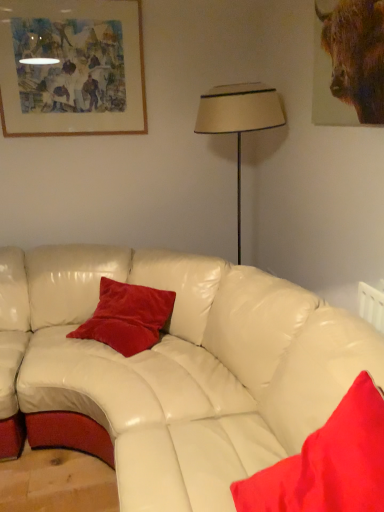
Question: Would you say velvet red pillow at center, the 2th pillow when ordered from front to back, is inside or outside velvet red pillow at lower right, arranged as the 1th pillow when viewed from the front?

Choices:
 (A) outside
 (B) inside

Answer: (A)

Question: In terms of width, does velvet red pillow at center, which ranks as the first pillow in back-to-front order, look wider or thinner when compared to velvet red pillow at lower right, the 1th pillow in the right-to-left sequence?

Choices:
 (A) wide
 (B) thin

Answer: (B)

Question: Which object is positioned closest to the wooden framed artwork at upper left?

Choices:
 (A) beige fabric lampshade at center
 (B) velvet red pillow at lower right, arranged as the 1th pillow when viewed from the front
 (C) brown furry bull at upper right
 (D) velvet red pillow at center, the 2th pillow when ordered from front to back

Answer: (A)

Question: Considering the real-world distances, which object is closest to the wooden framed artwork at upper left?

Choices:
 (A) beige fabric lampshade at center
 (B) brown furry bull at upper right
 (C) velvet red pillow at lower right, the 1th pillow in the right-to-left sequence
 (D) velvet red pillow at center, the 2th pillow when ordered from front to back

Answer: (A)